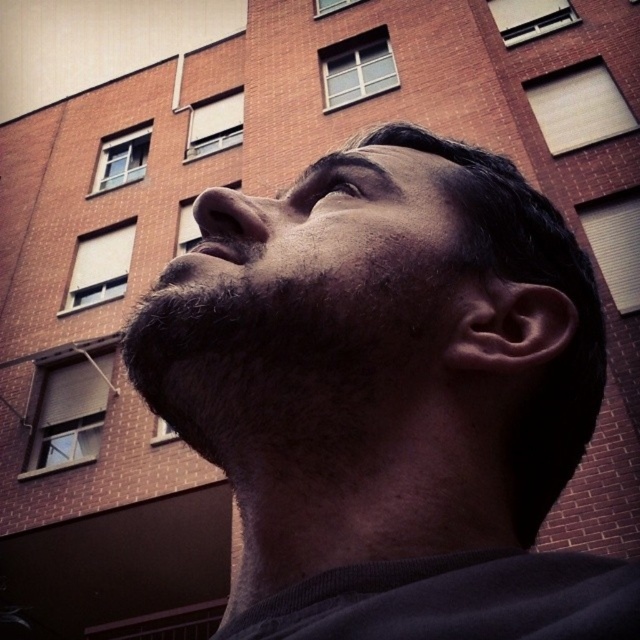
Is point (339, 211) closer to viewer compared to point (349, 179)?

Yes, it is.

Can you confirm if dark beard at center is shorter than brown matte eye at upper center?

No.

Which is in front, point (218, 202) or point (324, 192)?

Positioned in front is point (218, 202).

Locate an element on the screen. Image resolution: width=640 pixels, height=640 pixels. dark beard at center is located at coordinates (330, 232).

Is the position of dark hair at center less distant than that of dark beard at center?

Yes, dark hair at center is in front of dark beard at center.

Does dark hair at center have a greater width compared to dark beard at center?

Correct, the width of dark hair at center exceeds that of dark beard at center.

Is point (500, 256) more distant than point (326, 259)?

Yes, point (500, 256) is farther from viewer.

Where is `dark hair at center`? The height and width of the screenshot is (640, 640). dark hair at center is located at coordinates (390, 397).

Is point (214, 316) positioned in front of point (348, 188)?

Yes, point (214, 316) is in front of point (348, 188).

I want to click on dark hair at center, so click(390, 397).

This screenshot has width=640, height=640. Describe the element at coordinates (390, 397) in the screenshot. I see `dark hair at center` at that location.

The image size is (640, 640). Identify the location of dark hair at center. (390, 397).